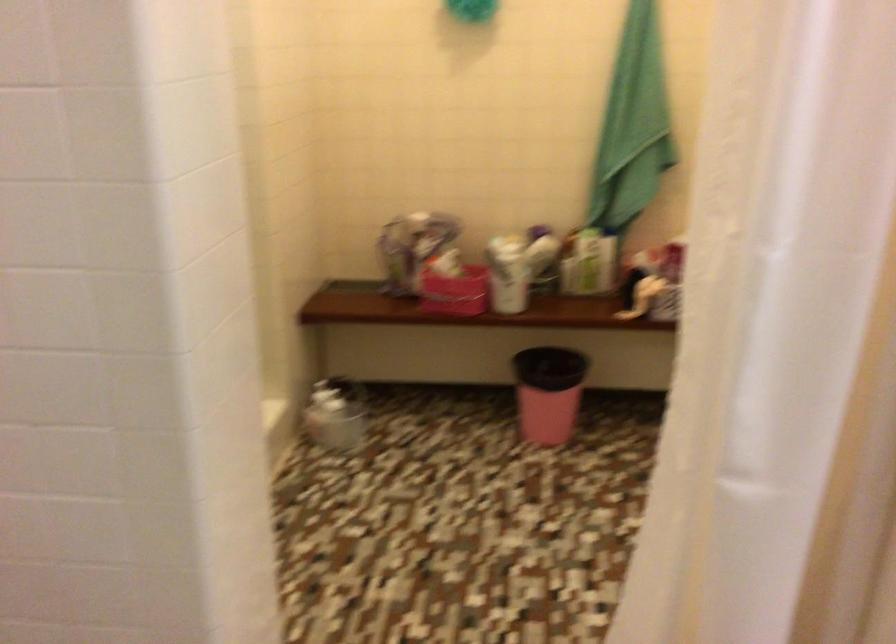
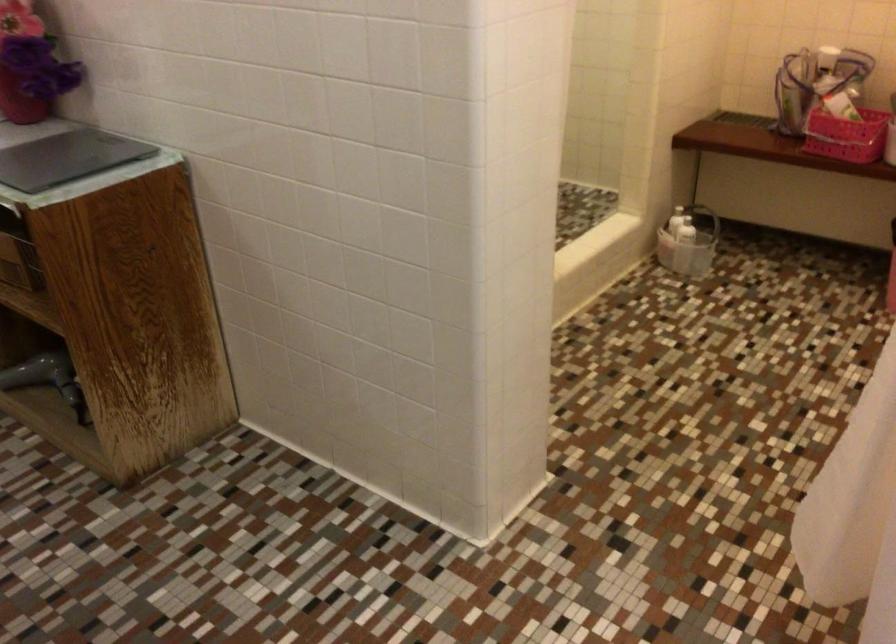
Find the pixel in the second image that matches [321,406] in the first image.

(678, 220)